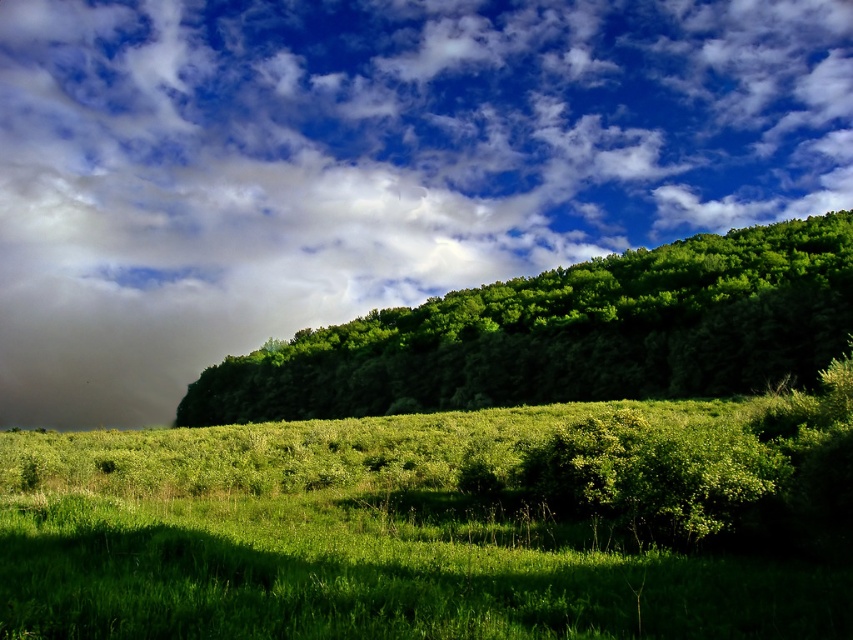
Question: Can you confirm if dark gray cloud at upper left is smaller than green leafy tree at upper center?

Choices:
 (A) yes
 (B) no

Answer: (B)

Question: Is dark gray cloud at upper left further to camera compared to green leafy tree at upper center?

Choices:
 (A) yes
 (B) no

Answer: (A)

Question: Which point appears farthest from the camera in this image?

Choices:
 (A) (785, 364)
 (B) (345, 314)

Answer: (B)

Question: Can you confirm if dark gray cloud at upper left is smaller than green leafy tree at upper center?

Choices:
 (A) yes
 (B) no

Answer: (B)

Question: Which point is farther to the camera?

Choices:
 (A) (376, 125)
 (B) (643, 394)

Answer: (A)